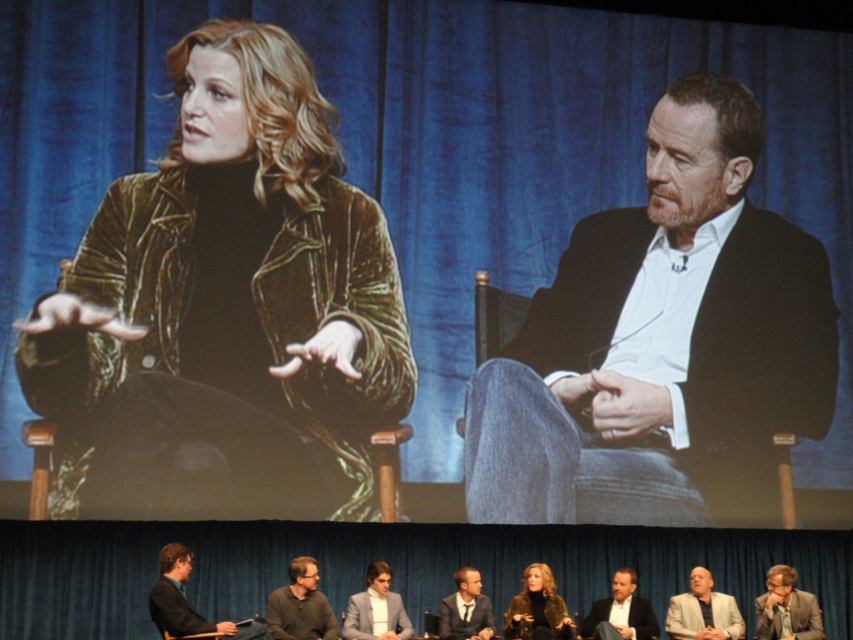
Measure the distance between point [68,272] and camera.

Point [68,272] is 38.79 meters away from camera.

Between velvet green jacket at upper left and matte gray suit at lower right, which one appears on the left side from the viewer's perspective?

From the viewer's perspective, velvet green jacket at upper left appears more on the left side.

Is point (328, 280) closer to viewer compared to point (793, 592)?

Yes, point (328, 280) is in front of point (793, 592).

Where is `velvet green jacket at upper left`? The image size is (853, 640). velvet green jacket at upper left is located at coordinates (227, 292).

Does dark gray suit at lower left have a greater height compared to dark gray shirt at lower left?

Yes, dark gray suit at lower left is taller than dark gray shirt at lower left.

At what (x,y) coordinates should I click in order to perform the action: click on dark gray suit at lower left. Please return your answer as a coordinate pair (x, y). The image size is (853, 640). Looking at the image, I should click on (187, 602).

Can you confirm if matte gray suit at lower right is wider than velvet brown jacket at center?

In fact, matte gray suit at lower right might be narrower than velvet brown jacket at center.

Find the location of a particular element. The width and height of the screenshot is (853, 640). matte gray suit at lower right is located at coordinates 786,609.

Who is more forward, (764, 614) or (523, 584)?

Point (523, 584)

Where is `matte gray suit at lower right`? This screenshot has height=640, width=853. matte gray suit at lower right is located at coordinates coord(786,609).